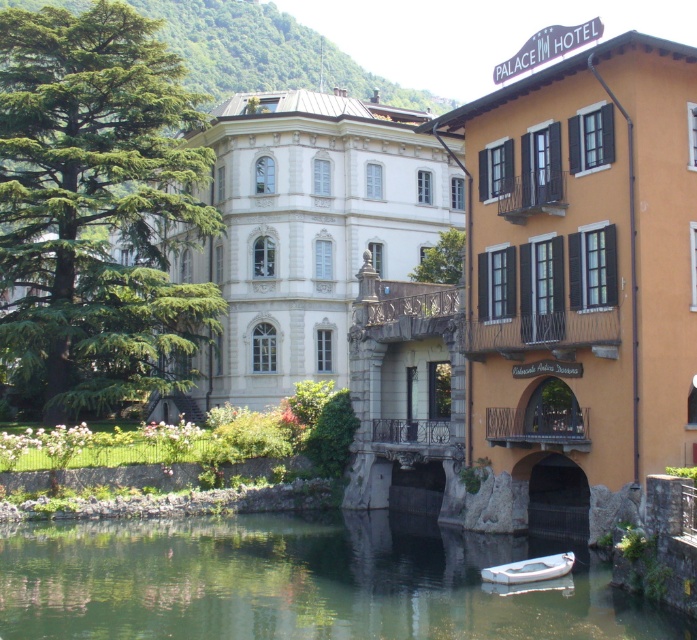
Question: Among these objects, which one is nearest to the camera?

Choices:
 (A) green smooth water at lower center
 (B) white plastic boat at lower center

Answer: (A)

Question: Which point is closer to the camera taking this photo?

Choices:
 (A) (559, 554)
 (B) (250, 602)

Answer: (B)

Question: Which of the following is the closest to the observer?

Choices:
 (A) green smooth water at lower center
 (B) white plastic boat at lower center

Answer: (A)

Question: Can you confirm if green smooth water at lower center is positioned below white plastic boat at lower center?

Choices:
 (A) yes
 (B) no

Answer: (A)

Question: In this image, where is green smooth water at lower center located relative to white plastic boat at lower center?

Choices:
 (A) below
 (B) above

Answer: (A)

Question: Is green smooth water at lower center to the right of white plastic boat at lower center from the viewer's perspective?

Choices:
 (A) yes
 (B) no

Answer: (B)